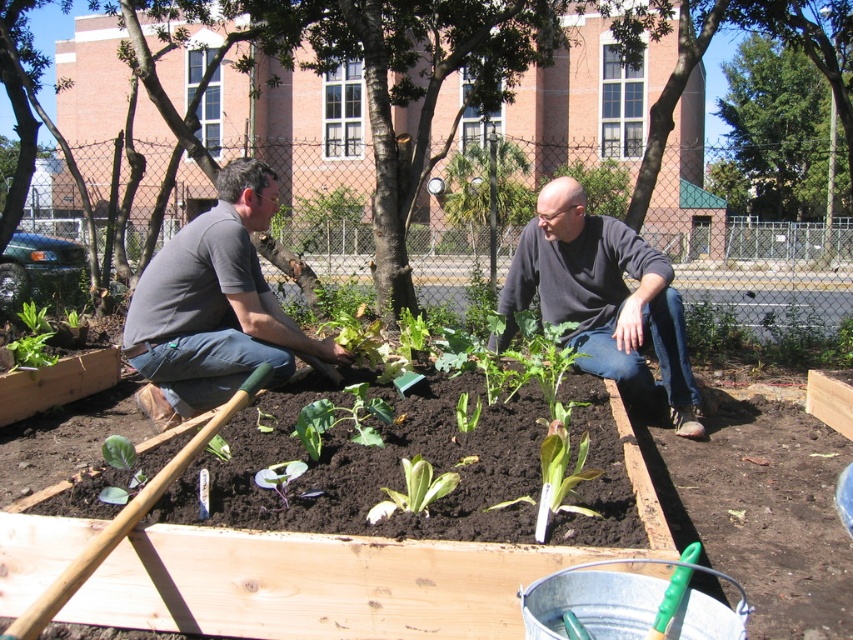
Question: Which object is positioned farthest from the green leafy plant at center?

Choices:
 (A) dark gray t-shirt at center
 (B) gray cotton shirt at center
 (C) dark gray sweater at center

Answer: (C)

Question: Can you confirm if gray cotton shirt at center is thinner than green leafy plant at center?

Choices:
 (A) yes
 (B) no

Answer: (B)

Question: Does dark gray t-shirt at center come behind dark gray sweater at center?

Choices:
 (A) yes
 (B) no

Answer: (A)

Question: Estimate the real-world distances between objects in this image. Which object is farther from the green leafy plant at center?

Choices:
 (A) dark gray t-shirt at center
 (B) gray cotton shirt at center

Answer: (A)

Question: Where is dark gray t-shirt at center located in relation to gray cotton shirt at center in the image?

Choices:
 (A) left
 (B) right

Answer: (B)

Question: Which of the following is the farthest from the observer?

Choices:
 (A) [698, 412]
 (B) [216, 326]
 (C) [450, 480]
 (D) [602, 362]

Answer: (A)